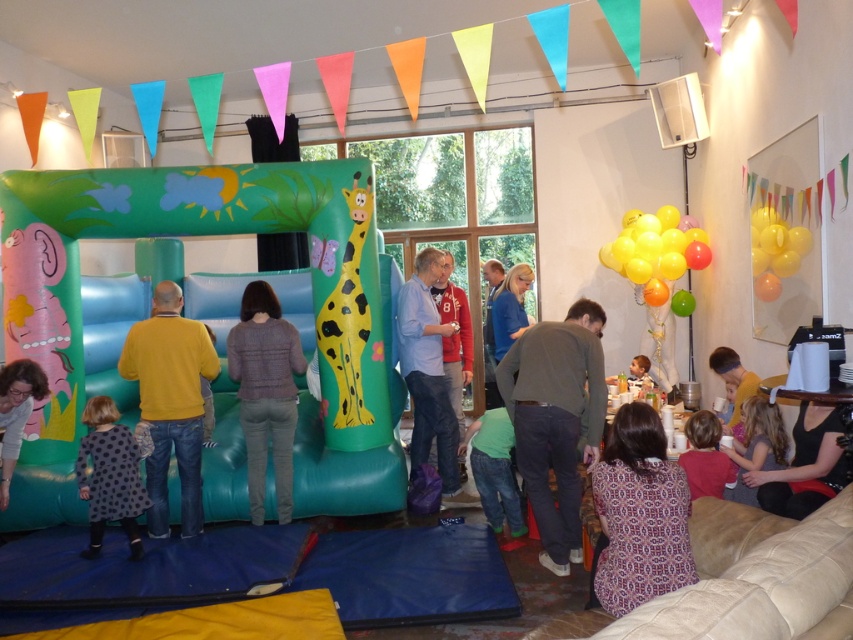
Image resolution: width=853 pixels, height=640 pixels. What do you see at coordinates (265, 392) in the screenshot?
I see `knitted sweater at center` at bounding box center [265, 392].

Does knitted sweater at center have a greater height compared to shiny metallic balloons at upper right?

Correct, knitted sweater at center is much taller as shiny metallic balloons at upper right.

Does point (254, 442) come behind point (660, 209)?

No, (254, 442) is closer to viewer.

Locate an element on the screen. The image size is (853, 640). knitted sweater at center is located at coordinates [x=265, y=392].

Can you confirm if shiny metallic balloons at upper right is shorter than matte gray shirt at lower right?

No.

Which is more to the right, shiny metallic balloons at upper right or matte gray shirt at lower right?

shiny metallic balloons at upper right

Is point (666, 208) farther from camera compared to point (753, 444)?

That is True.

Locate an element on the screen. The height and width of the screenshot is (640, 853). shiny metallic balloons at upper right is located at coordinates (654, 252).

Between matte gray shirt at lower right and matte pink shirt at lower right, which one is positioned higher?

matte gray shirt at lower right is above.

Is matte gray shirt at lower right in front of matte pink shirt at lower right?

No, it is not.

Measure the distance between point (782,442) and camera.

The distance of point (782,442) from camera is 3.83 meters.

Locate an element on the screen. The height and width of the screenshot is (640, 853). matte gray shirt at lower right is located at coordinates (757, 445).